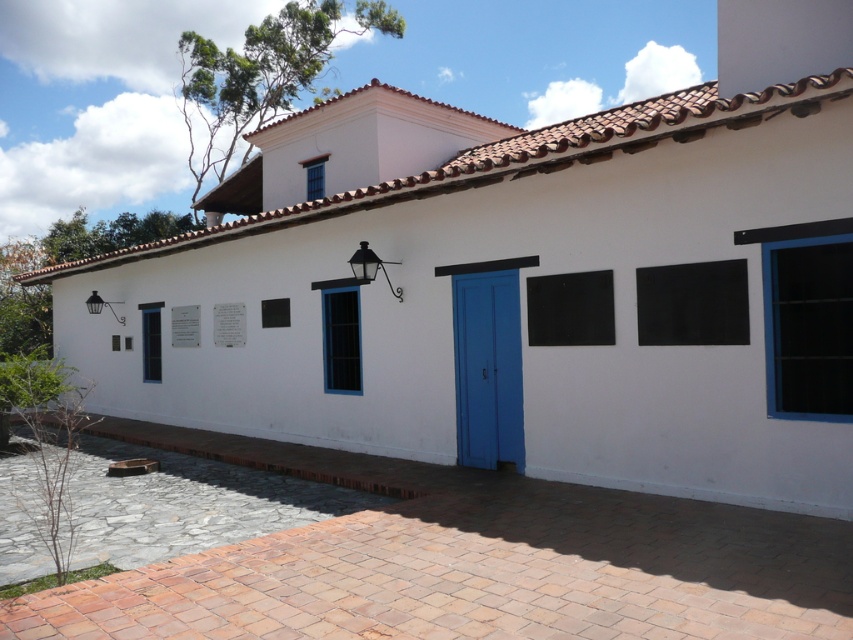
Looking at this image, between black matte board at center and black glass window at center, which one has more height?

black glass window at center is taller.

Which is above, black matte board at center or black glass window at center?

Positioned higher is black matte board at center.

Measure the distance between point (552, 291) and camera.

26.26 feet

At what (x,y) coordinates should I click in order to perform the action: click on black matte board at center. Please return your answer as a coordinate pair (x, y). The height and width of the screenshot is (640, 853). Looking at the image, I should click on (570, 308).

Can you confirm if brick paving at center is positioned above matte blue door at center?

Incorrect, brick paving at center is not positioned above matte blue door at center.

Who is taller, brick paving at center or matte blue door at center?

Standing taller between the two is matte blue door at center.

Between point (341, 467) and point (479, 417), which one is positioned in front?

Point (479, 417)

You are a GUI agent. You are given a task and a screenshot of the screen. Output one action in this format:
    pyautogui.click(x=<x>, y=<y>)
    Task: Click on the brick paving at center
    The image size is (853, 640).
    Given the screenshot: What is the action you would take?
    pyautogui.click(x=466, y=563)

Who is lower down, blue matte window at right or black matte board at right?

blue matte window at right is below.

Which is more to the left, blue matte window at right or black matte board at right?

black matte board at right is more to the left.

This screenshot has height=640, width=853. What do you see at coordinates (808, 326) in the screenshot?
I see `blue matte window at right` at bounding box center [808, 326].

Where is `blue matte window at right`? blue matte window at right is located at coordinates (808, 326).